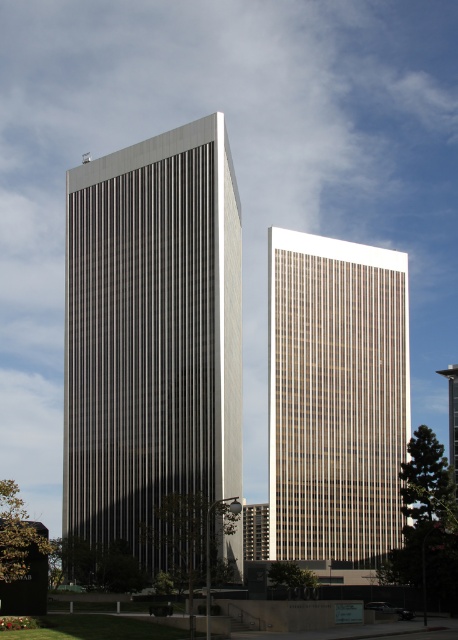
Does white textured building at center appear over beige glass tower at center?

Incorrect, white textured building at center is not positioned above beige glass tower at center.

From the picture: Who is more distant from viewer, [135,340] or [398,467]?

The point [398,467] is behind.

Where is `white textured building at center`? white textured building at center is located at coordinates (152, 336).